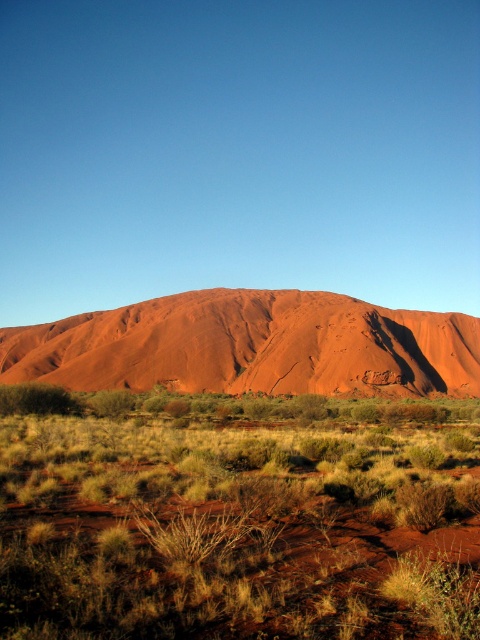
Question: Is dry grass at lower center above rustic sandstone mountain at center?

Choices:
 (A) no
 (B) yes

Answer: (A)

Question: Among these objects, which one is farthest from the camera?

Choices:
 (A) rustic sandstone mountain at center
 (B) dry grass at lower center

Answer: (A)

Question: Which of the following is the closest to the observer?

Choices:
 (A) rustic sandstone mountain at center
 (B) dry grass at lower center

Answer: (B)

Question: Does dry grass at lower center appear over rustic sandstone mountain at center?

Choices:
 (A) no
 (B) yes

Answer: (A)

Question: Does dry grass at lower center appear under rustic sandstone mountain at center?

Choices:
 (A) yes
 (B) no

Answer: (A)